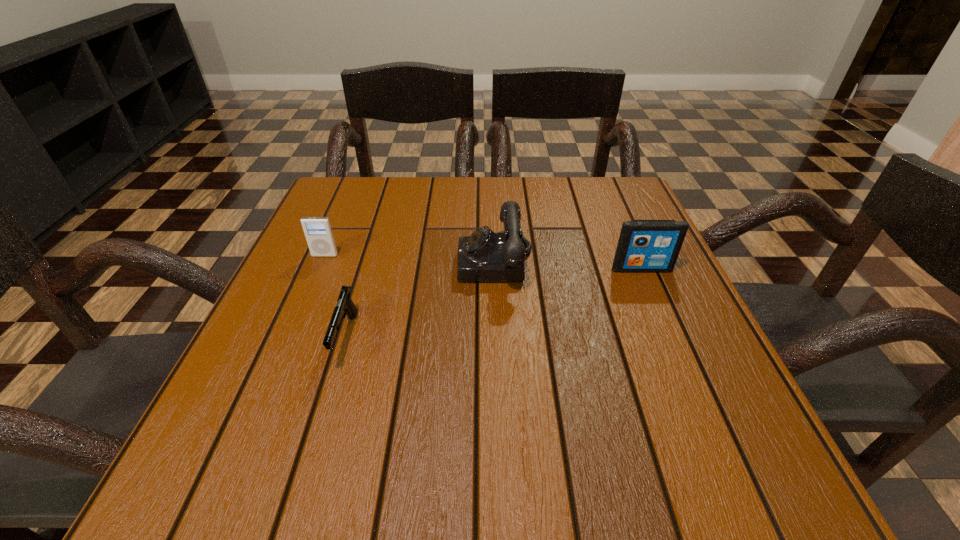
Locate an element on the screen. blank space located on the front screen of the taller iPod is located at coordinates (685, 370).

Where is `vacant space positioned 0.200m on the front-facing side of the third tallest object`? This screenshot has width=960, height=540. vacant space positioned 0.200m on the front-facing side of the third tallest object is located at coordinates pos(296,325).

Where is `vacant region located at the aiming end of the nearest object`? This screenshot has height=540, width=960. vacant region located at the aiming end of the nearest object is located at coordinates (309, 457).

The width and height of the screenshot is (960, 540). In order to click on iPod positioned at the left edge in this screenshot , I will do `click(318, 232)`.

Where is `gun situated at the left edge`? gun situated at the left edge is located at coordinates (345, 306).

You are a GUI agent. You are given a task and a screenshot of the screen. Output one action in this format:
    pyautogui.click(x=<x>, y=<y>)
    Task: Click on the object located at the right edge
    This screenshot has width=960, height=540.
    Given the screenshot: What is the action you would take?
    pyautogui.click(x=645, y=246)

Where is `free spot at the far edge of the desktop`? The height and width of the screenshot is (540, 960). free spot at the far edge of the desktop is located at coordinates (549, 204).

I want to click on vacant space at the near edge of the desktop, so click(330, 468).

Locate an element on the screen. vacant space at the left edge of the desktop is located at coordinates (311, 277).

I want to click on free point at the right edge, so click(x=660, y=294).